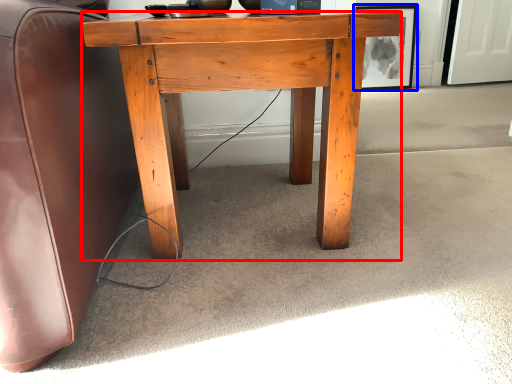
Question: Which point is further to the camera, desk (highlighted by a red box) or picture frame (highlighted by a blue box)?

Choices:
 (A) desk
 (B) picture frame

Answer: (B)